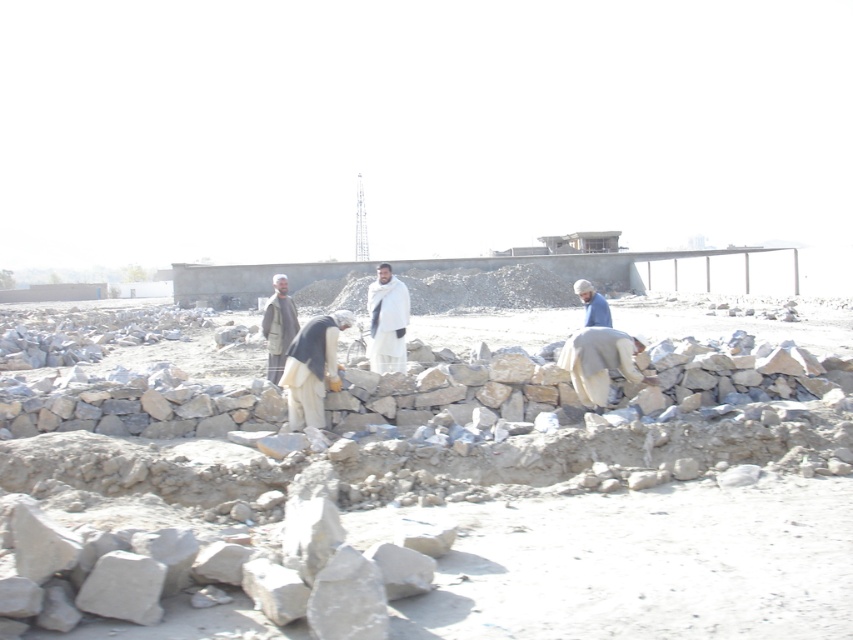
Who is higher up, white woolen shawl at center or light brown fabric jacket at center?

white woolen shawl at center

Between point (372, 358) and point (271, 300), which one is positioned in front?

Point (372, 358)

At what (x,y) coordinates should I click in order to perform the action: click on white woolen shawl at center. Please return your answer as a coordinate pair (x, y). Looking at the image, I should click on (387, 321).

Who is higher up, gray stone wall at center or dark gray fabric construction worker at center?

Positioned higher is dark gray fabric construction worker at center.

Does gray stone wall at center appear under dark gray fabric construction worker at center?

Yes, gray stone wall at center is below dark gray fabric construction worker at center.

Who is more distant from viewer, (521, 456) or (334, 369)?

The point (334, 369) is more distant.

This screenshot has width=853, height=640. In order to click on gray stone wall at center in this screenshot , I will do `click(624, 532)`.

Which of these two, dark gray fabric construction worker at center or blue fabric construction worker at right, stands taller?

blue fabric construction worker at right is taller.

Is point (328, 330) more distant than point (605, 308)?

No, it is in front of (605, 308).

Locate an element on the screen. Image resolution: width=853 pixels, height=640 pixels. dark gray fabric construction worker at center is located at coordinates (312, 368).